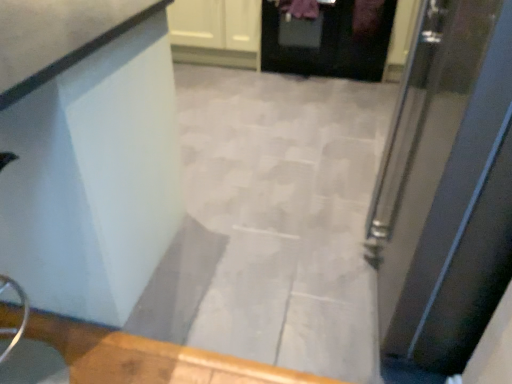
Question: From a real-world perspective, is metallic silver door at right, the second door when ordered from back to front, beneath white glossy cabinet at upper center?

Choices:
 (A) yes
 (B) no

Answer: (B)

Question: Can white glossy cabinet at upper center be found inside metallic silver door at right, which is the 1th door from front to back?

Choices:
 (A) no
 (B) yes

Answer: (A)

Question: Is metallic silver door at right, marked as the second door in a top-to-bottom arrangement, oriented towards white glossy cabinet at upper center?

Choices:
 (A) yes
 (B) no

Answer: (B)

Question: Is metallic silver door at right, marked as the second door in a top-to-bottom arrangement, in front of white glossy cabinet at upper center?

Choices:
 (A) no
 (B) yes

Answer: (B)

Question: Does metallic silver door at right, which is the first door from bottom to top, have a lesser height compared to white glossy cabinet at upper center?

Choices:
 (A) yes
 (B) no

Answer: (B)

Question: In terms of width, does metallic silver door at right, marked as the second door in a top-to-bottom arrangement, look wider or thinner when compared to white glossy counter at upper left?

Choices:
 (A) thin
 (B) wide

Answer: (A)

Question: Considering the relative positions of metallic silver door at right, the second door when ordered from back to front, and white glossy counter at upper left in the image provided, is metallic silver door at right, the second door when ordered from back to front, to the left or to the right of white glossy counter at upper left?

Choices:
 (A) right
 (B) left

Answer: (A)

Question: From the image's perspective, is metallic silver door at right, marked as the second door in a top-to-bottom arrangement, above or below white glossy counter at upper left?

Choices:
 (A) above
 (B) below

Answer: (A)

Question: Is metallic silver door at right, which is the 1th door from front to back, bigger or smaller than white glossy counter at upper left?

Choices:
 (A) big
 (B) small

Answer: (B)

Question: Is white glossy counter at upper left spatially inside black glossy door at upper center, the 2th door from the bottom, or outside of it?

Choices:
 (A) inside
 (B) outside

Answer: (B)

Question: From their relative heights in the image, would you say white glossy counter at upper left is taller or shorter than black glossy door at upper center, the 2th door from the bottom?

Choices:
 (A) tall
 (B) short

Answer: (A)

Question: Is white glossy counter at upper left in front of or behind black glossy door at upper center, acting as the first door starting from the back, in the image?

Choices:
 (A) behind
 (B) front

Answer: (B)

Question: In the image, is white glossy counter at upper left on the left side or the right side of black glossy door at upper center, the 2th door from the bottom?

Choices:
 (A) left
 (B) right

Answer: (A)

Question: Is white glossy cabinet at upper center in front of or behind black glossy door at upper center, the 2th door from the bottom, in the image?

Choices:
 (A) front
 (B) behind

Answer: (B)

Question: From a real-world perspective, is white glossy cabinet at upper center positioned above or below black glossy door at upper center, acting as the first door starting from the back?

Choices:
 (A) above
 (B) below

Answer: (B)